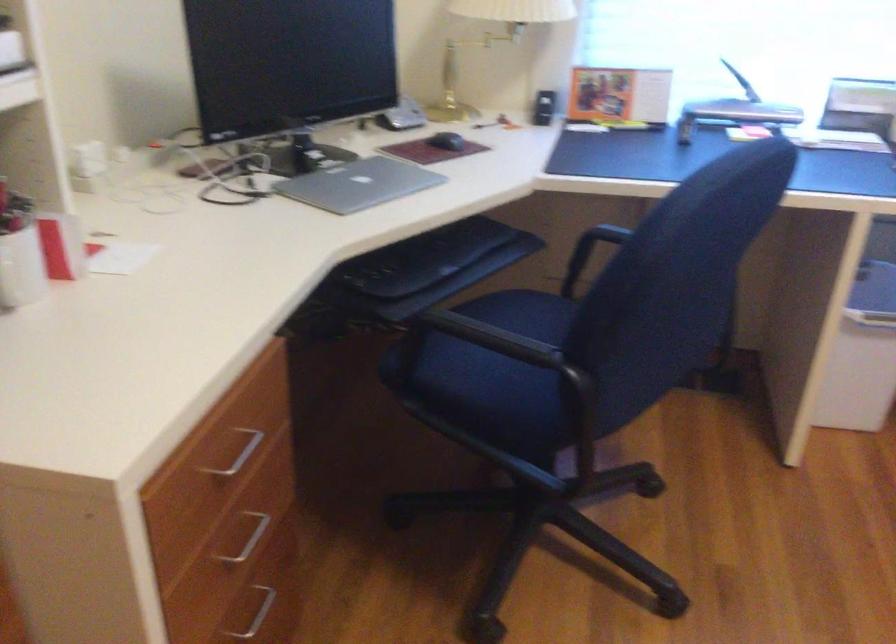
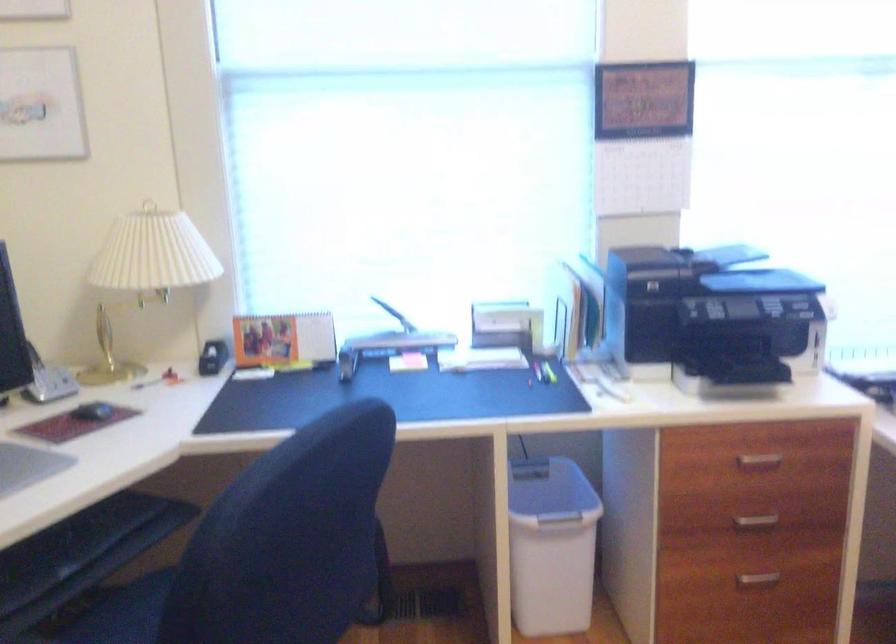
Question: What movement of the cameraman would produce the second image?

Choices:
 (A) Left
 (B) Right
 (C) Forward
 (D) Backward

Answer: (B)